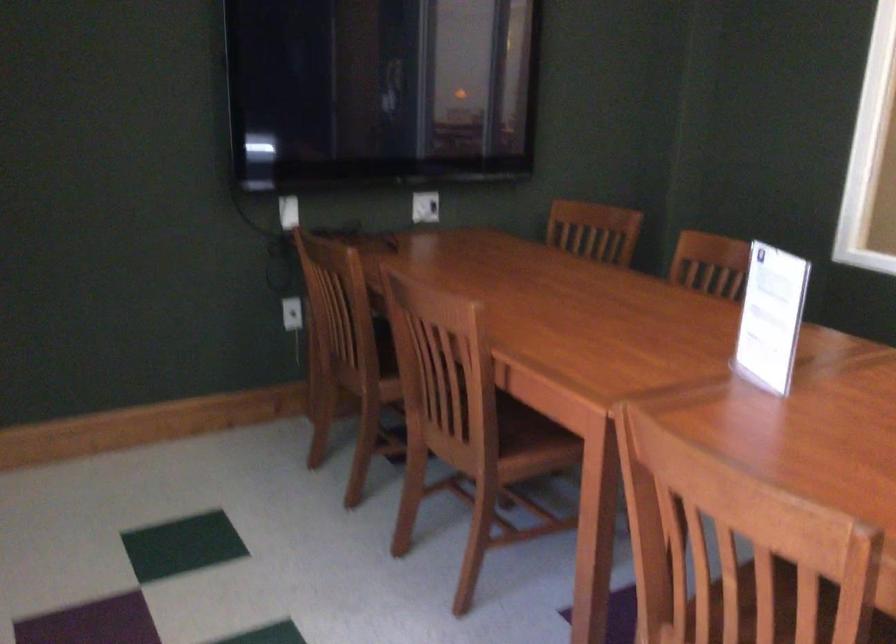
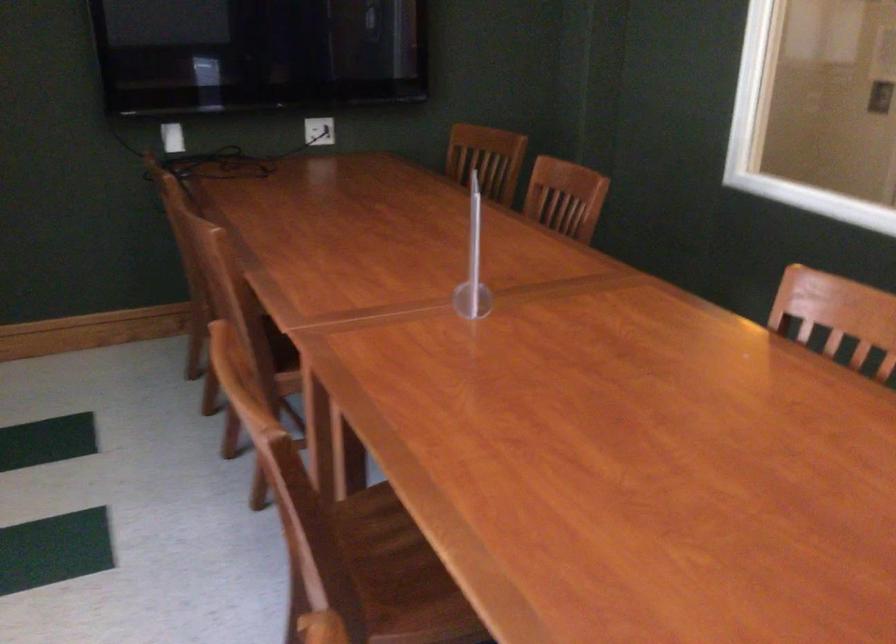
Where in the second image is the point corresponding to pixel 595 232 from the first image?

(487, 158)